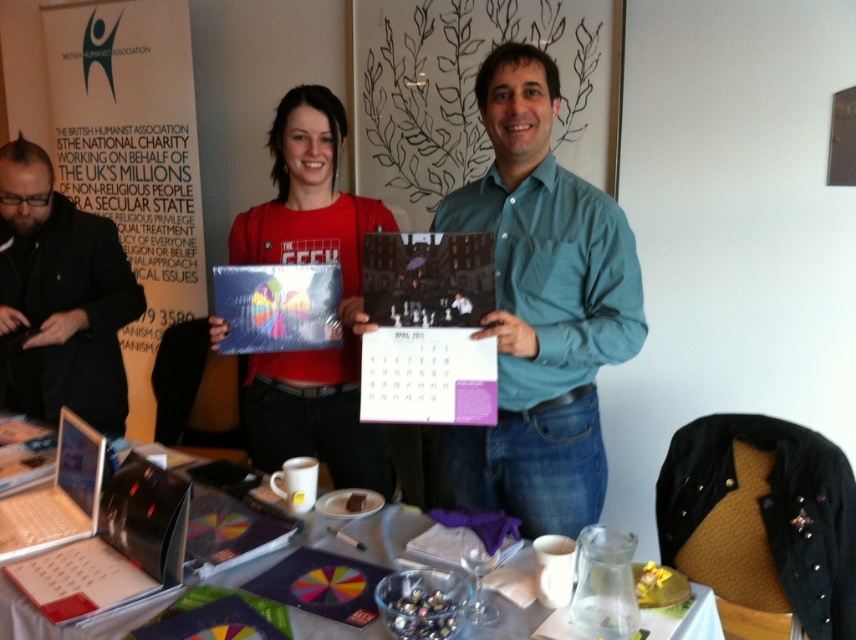
Is silver metallic laptop at lower left behind metallic glossy calendar at center?

No, silver metallic laptop at lower left is closer to the viewer.

Which is more to the right, silver metallic laptop at lower left or metallic glossy calendar at center?

metallic glossy calendar at center is more to the right.

Where is `silver metallic laptop at lower left`? The width and height of the screenshot is (856, 640). silver metallic laptop at lower left is located at coordinates (114, 547).

Who is shorter, black matte jacket at left or metallic glossy calendar at center?

metallic glossy calendar at center

Who is lower down, black matte jacket at left or metallic glossy calendar at center?

metallic glossy calendar at center

Is point (40, 240) closer to viewer compared to point (337, 282)?

No, (40, 240) is behind (337, 282).

In order to click on black matte jacket at left in this screenshot , I will do `click(58, 298)`.

Find the location of `black matte jacket at left`. black matte jacket at left is located at coordinates (58, 298).

Does black matte jacket at left appear on the left side of translucent plastic table at center?

Correct, you'll find black matte jacket at left to the left of translucent plastic table at center.

Which is in front, point (122, 433) or point (241, 573)?

Point (241, 573) is in front.

I want to click on black matte jacket at left, so click(58, 298).